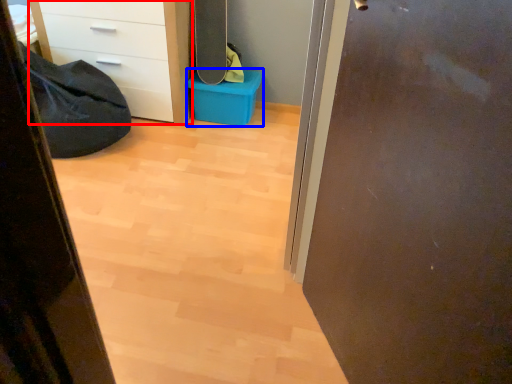
Question: Which object appears farthest to the camera in this image, chest of drawers (highlighted by a red box) or storage box (highlighted by a blue box)?

Choices:
 (A) chest of drawers
 (B) storage box

Answer: (B)